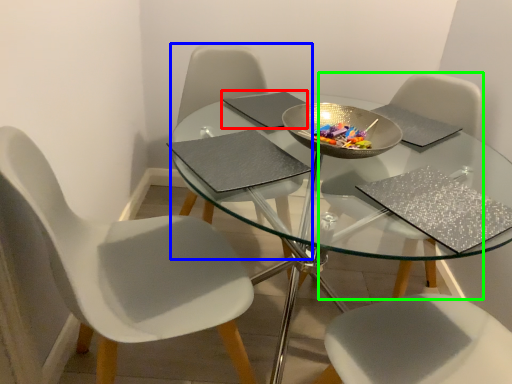
Question: Which object is positioned farthest from pad (highlighted by a red box)? Select from chair (highlighted by a blue box) and chair (highlighted by a green box).

Choices:
 (A) chair
 (B) chair

Answer: (B)